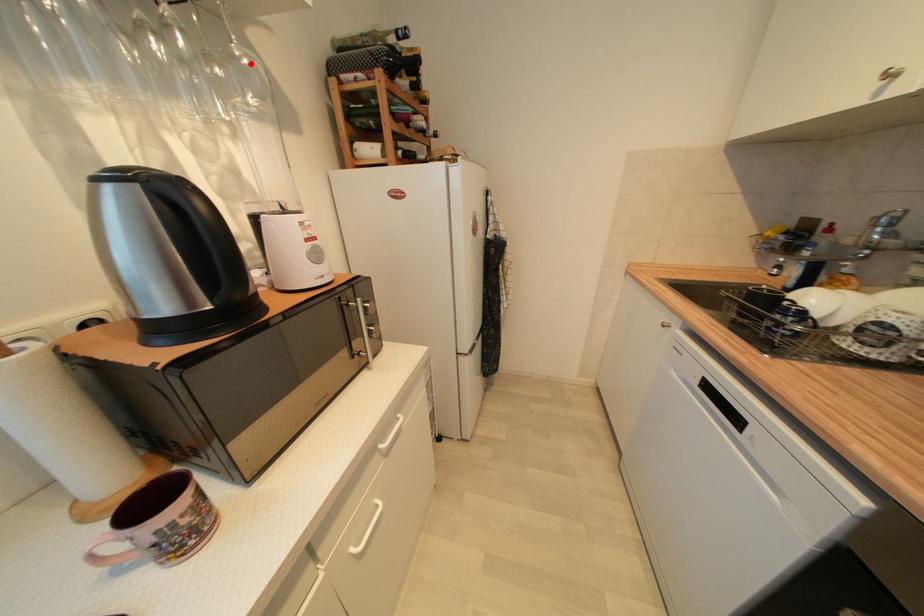
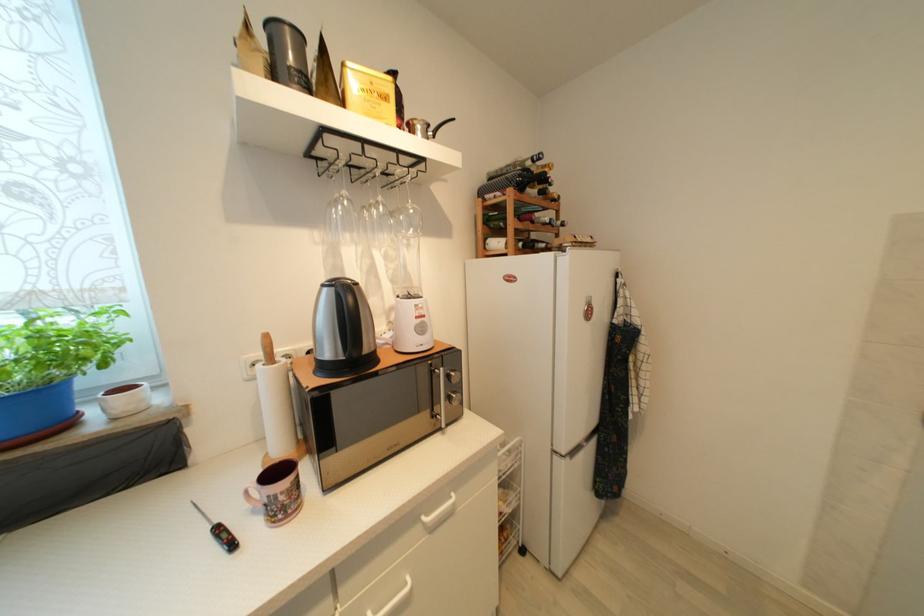
Question: I am providing you with two images of the same scene from different viewpoints. A red point is marked on the first image. At the location where the point appears in image 1, is it still visible in image 2?

Choices:
 (A) Yes
 (B) No

Answer: (A)